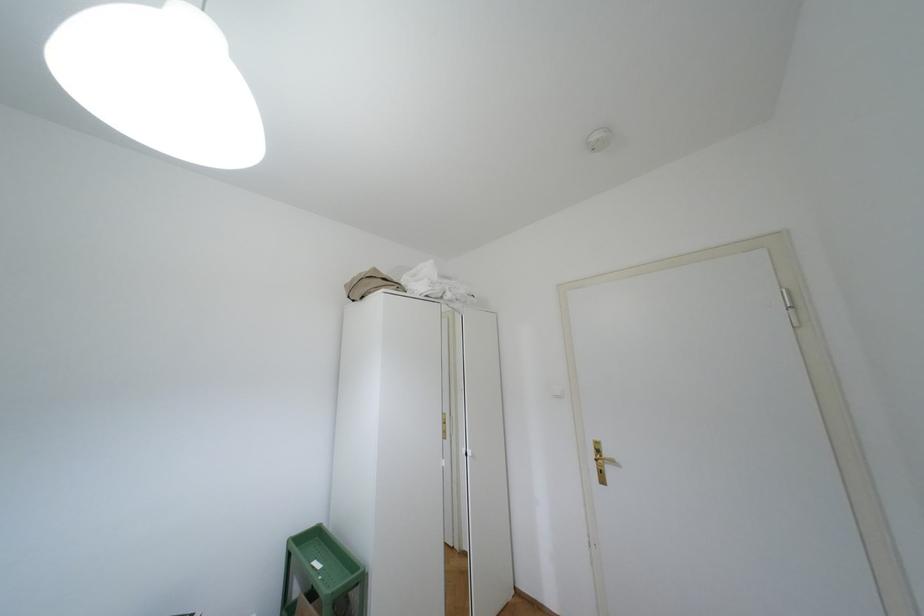
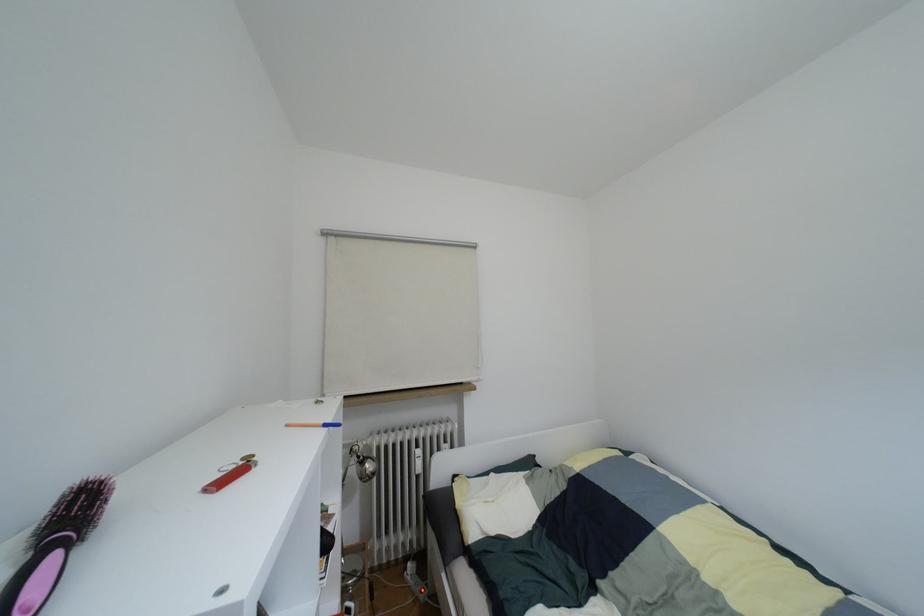
Question: Based on the continuous images, in which direction is the camera rotating? Reply with the corresponding letter.

Choices:
 (A) Left
 (B) Right
 (C) Up
 (D) Down

Answer: (A)